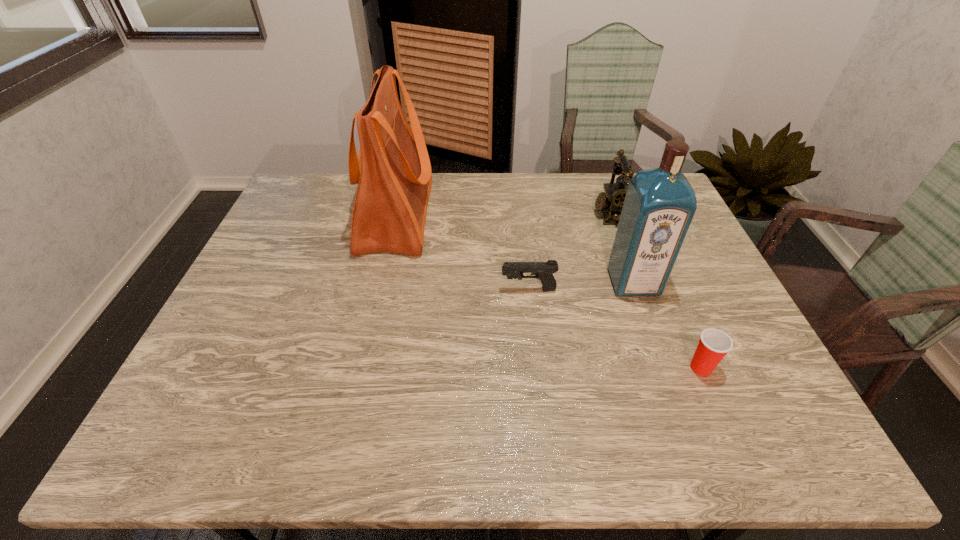
In the image, there is a desktop. Find the location of `vacant region at the right edge`. vacant region at the right edge is located at coordinates (707, 294).

At what (x,y) coordinates should I click in order to perform the action: click on vacant space at the far left corner of the desktop. Please return your answer as a coordinate pair (x, y). The image size is (960, 540). Looking at the image, I should click on (310, 175).

At what (x,y) coordinates should I click in order to perform the action: click on empty location between the second object from left to right and the nearest object. Please return your answer as a coordinate pair (x, y). The height and width of the screenshot is (540, 960). Looking at the image, I should click on (614, 329).

I want to click on vacant space that is in between the second object from left to right and the liquor, so click(x=581, y=286).

Where is `free point between the pistol and the nearest object`? This screenshot has height=540, width=960. free point between the pistol and the nearest object is located at coordinates (614, 329).

Identify the location of free area in between the nearest object and the liquor. [667, 325].

Find the location of `free space that is in between the liquor and the nearest object`. free space that is in between the liquor and the nearest object is located at coordinates point(667,325).

You are a GUI agent. You are given a task and a screenshot of the screen. Output one action in this format:
    pyautogui.click(x=<x>, y=<y>)
    Task: Click on the vacant space that's between the nearest object and the shopping bag
    Image resolution: width=960 pixels, height=540 pixels.
    Given the screenshot: What is the action you would take?
    pyautogui.click(x=548, y=292)

At what (x,y) coordinates should I click in order to perform the action: click on empty space that is in between the liquor and the leftmost object. Please return your answer as a coordinate pair (x, y). The width and height of the screenshot is (960, 540). Looking at the image, I should click on (515, 249).

Locate an element on the screen. The height and width of the screenshot is (540, 960). free space between the pistol and the Dixie cup is located at coordinates (614, 329).